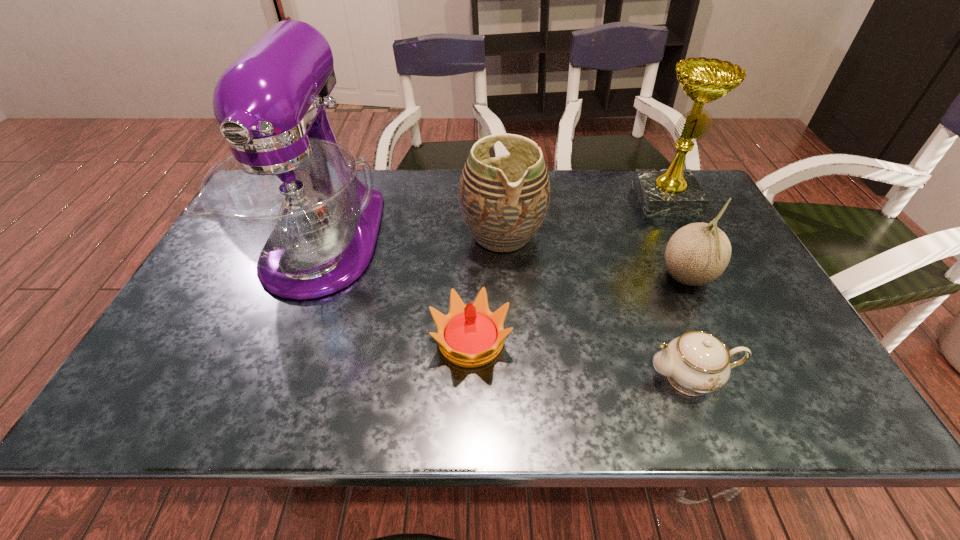
You are a GUI agent. You are given a task and a screenshot of the screen. Output one action in this format:
    pyautogui.click(x=<x>, y=<y>)
    Task: Click on the award at the right edge
    This screenshot has height=540, width=960.
    Given the screenshot: What is the action you would take?
    pyautogui.click(x=675, y=191)

Where is `cantaloup present at the right edge`? The height and width of the screenshot is (540, 960). cantaloup present at the right edge is located at coordinates (697, 254).

Identify the location of object situated at the far left corner. (289, 198).

This screenshot has width=960, height=540. What are the coordinates of `object located at the far right corner` in the screenshot? It's located at (675, 191).

In the image, there is a desktop. Where is `vacant space at the far edge`? The width and height of the screenshot is (960, 540). vacant space at the far edge is located at coordinates (576, 204).

The image size is (960, 540). Identify the location of vacant region at the near edge of the desktop. (361, 406).

In the image, there is a desktop. Find the location of `vacant area at the left edge`. vacant area at the left edge is located at coordinates (230, 256).

Locate an element on the screen. vacant space at the near left corner of the desktop is located at coordinates (157, 420).

In order to click on free space at the near right corner of the desktop in this screenshot , I will do `click(785, 402)`.

I want to click on free area in between the leftmost object and the cantaloup, so click(505, 260).